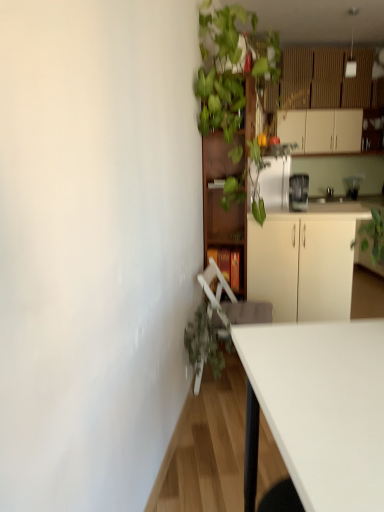
Question: From the image's perspective, is satin silver blender at upper right, which ranks as the 1th appliance in front-to-back order, positioned above or below brown wooden bookshelf at center, arranged as the first cabinetry when viewed from the left?

Choices:
 (A) below
 (B) above

Answer: (B)

Question: Considering their positions, is satin silver blender at upper right, which ranks as the 1th appliance in front-to-back order, located in front of or behind brown wooden bookshelf at center, acting as the 1th cabinetry starting from the bottom?

Choices:
 (A) front
 (B) behind

Answer: (A)

Question: Which object is positioned farthest from the green leafy plant at upper center?

Choices:
 (A) wooden bookshelf at upper center
 (B) white matte cabinet at upper right, which ranks as the 3th cabinetry in front-to-back order
 (C) green matte plant at lower left
 (D) white matte cabinet at center, which is the 2th cabinetry in left-to-right order
 (E) clear glass blender at upper right, which is counted as the second appliance, starting from the front

Answer: (E)

Question: Which is nearer to the clear glass blender at upper right, the second appliance positioned from the left?

Choices:
 (A) white plastic swivel chair at lower center
 (B) white matte cabinet at upper right, the 3th cabinetry from the bottom
 (C) brown wooden bookshelf at center, placed as the 2th cabinetry when sorted from front to back
 (D) green leafy plant at upper center
 (E) white matte cabinet at center, which is the 2th cabinetry in left-to-right order

Answer: (B)